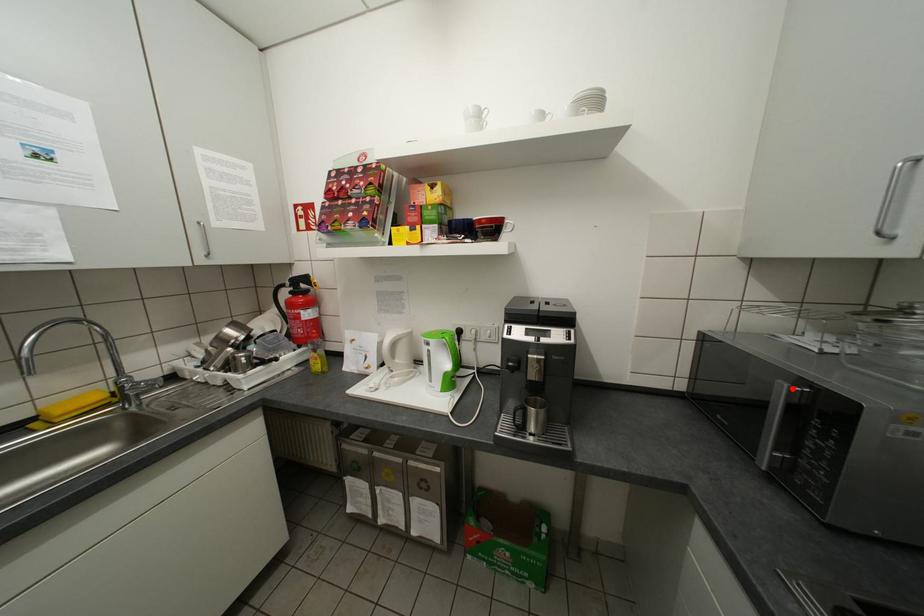
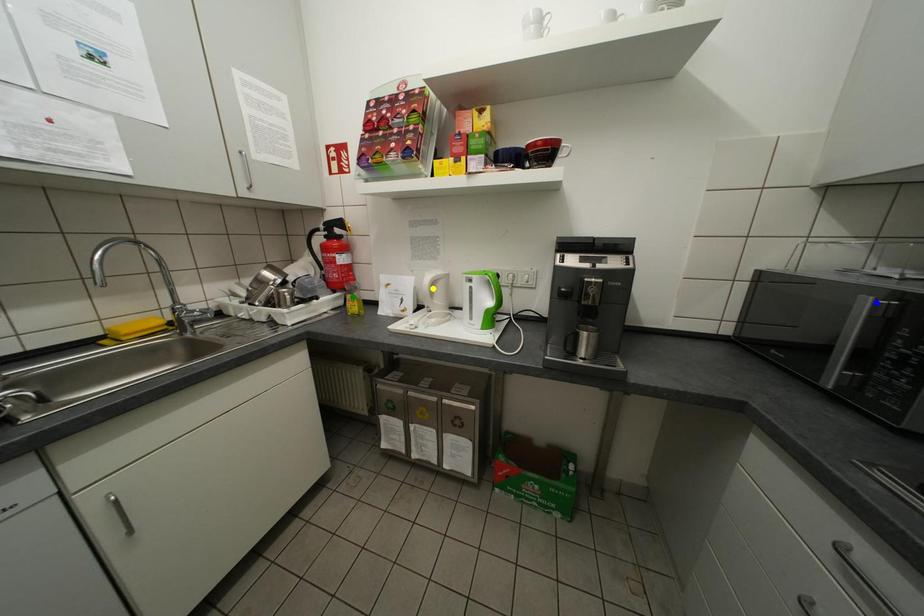
Question: I am providing you with two images of the same scene from different viewpoints. A red point is marked on the first image. You are given multiple points on the second image. Which point in image 2 is actually the same real-world point as the red point in image 1?

Choices:
 (A) green point
 (B) yellow point
 (C) blue point

Answer: (C)